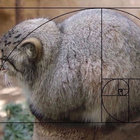
The width and height of the screenshot is (140, 140). I want to click on dark spot on wall, so click(4, 15).